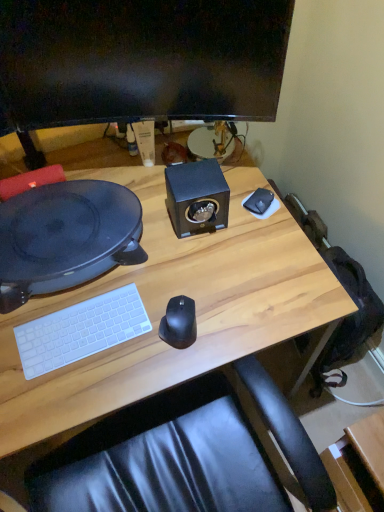
The width and height of the screenshot is (384, 512). I want to click on vacant area that lies between black matte mouse at center and white matte keyboard at lower left, so click(x=129, y=339).